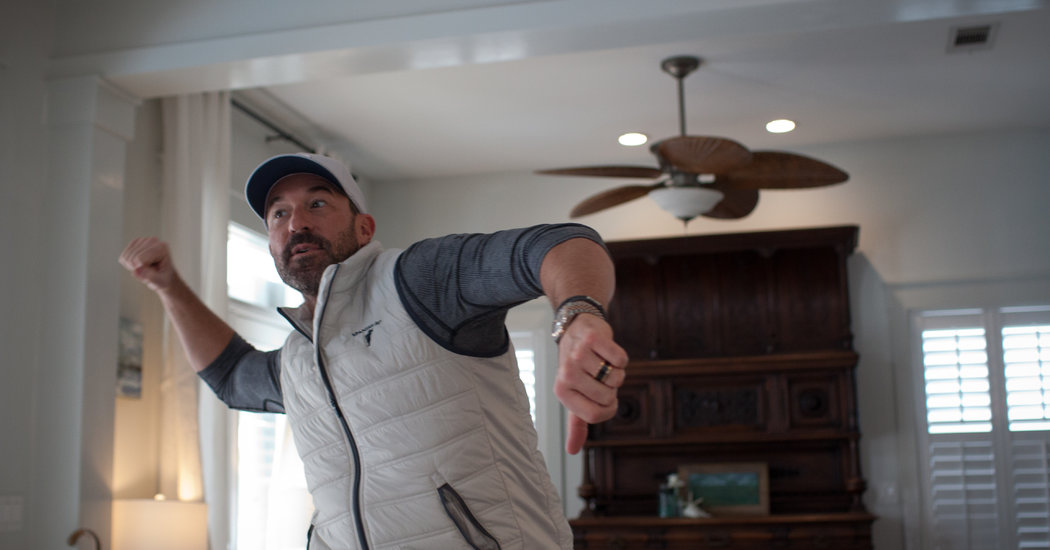
Image resolution: width=1050 pixels, height=550 pixels. I want to click on white window blinds, so click(x=966, y=471), click(x=1029, y=392), click(x=964, y=389), click(x=1025, y=470).